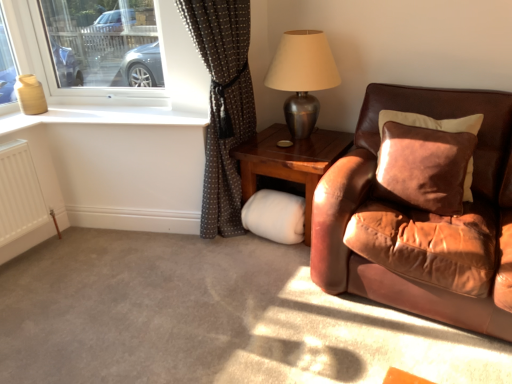
Where is `blank area beneath white matte radiator at lower left (from a real-world perspective)`? This screenshot has width=512, height=384. blank area beneath white matte radiator at lower left (from a real-world perspective) is located at coordinates (35, 256).